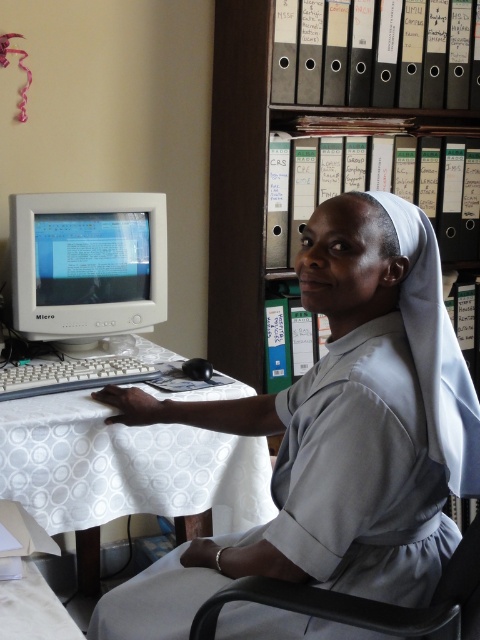
Question: Which of the following is the closest to the observer?

Choices:
 (A) white fabric-covered desk at center
 (B) black plastic chair at lower center

Answer: (B)

Question: Can you confirm if white fabric-covered desk at center is positioned above black file folders at upper center?

Choices:
 (A) no
 (B) yes

Answer: (A)

Question: Is white fabric-covered desk at center positioned in front of black plastic chair at lower center?

Choices:
 (A) yes
 (B) no

Answer: (B)

Question: Estimate the real-world distances between objects in this image. Which object is farther from the white fabric-covered desk at center?

Choices:
 (A) gray matte nun's habit at center
 (B) black file folders at upper center
 (C) matte white monitor at left
 (D) black plastic chair at lower center

Answer: (B)

Question: Is white fabric-covered desk at center positioned in front of black plastic chair at lower center?

Choices:
 (A) no
 (B) yes

Answer: (A)

Question: Which object is closer to the camera taking this photo?

Choices:
 (A) matte white monitor at left
 (B) white fabric-covered desk at center

Answer: (B)